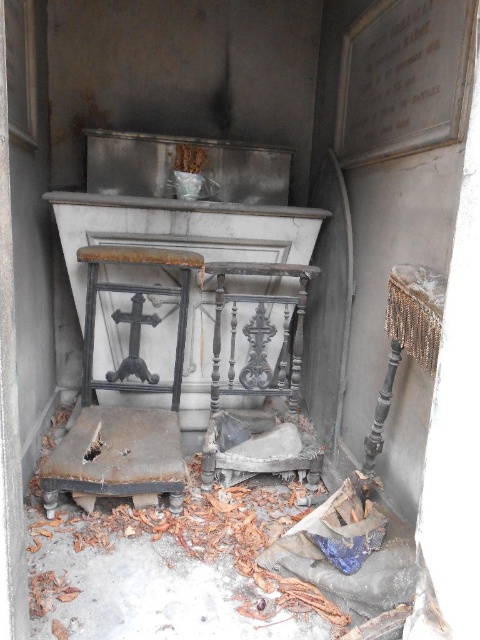
Question: Which point is farther to the camera?

Choices:
 (A) silver metallic stool at right
 (B) dark wood ornate chair at center
 (C) rusty metal table at center
 (D) rusty metal stool at center

Answer: (C)

Question: Is the position of dark wood ornate chair at center more distant than that of silver metallic stool at right?

Choices:
 (A) yes
 (B) no

Answer: (A)

Question: Where is dark wood ornate chair at center located in relation to silver metallic stool at right in the image?

Choices:
 (A) right
 (B) left

Answer: (B)

Question: Does rusty metal stool at center appear over silver metallic stool at right?

Choices:
 (A) yes
 (B) no

Answer: (A)

Question: Based on their relative distances, which object is nearer to the rusty metal table at center?

Choices:
 (A) rusty metal stool at center
 (B) silver metallic stool at right

Answer: (A)

Question: Which object is farther from the camera taking this photo?

Choices:
 (A) rusty metal table at center
 (B) silver metallic stool at right
 (C) rusty metal stool at center
 (D) dark wood ornate chair at center

Answer: (A)